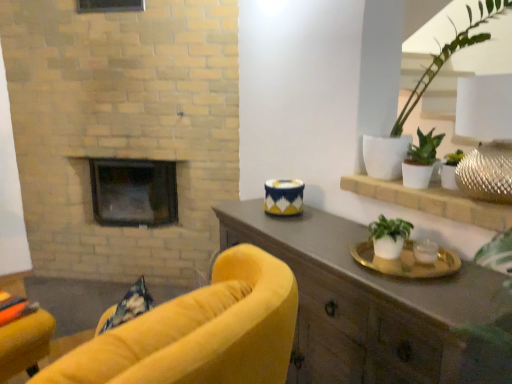
Question: Is white matte pot at upper right, the 1th houseplant from the top, oriented away from white matte plant at right, arranged as the fourth houseplant when viewed from the top?

Choices:
 (A) yes
 (B) no

Answer: (B)

Question: From a real-world perspective, is white matte pot at upper right, the 1th houseplant from the top, on white matte plant at right, arranged as the fourth houseplant when viewed from the top?

Choices:
 (A) no
 (B) yes

Answer: (B)

Question: Does white matte pot at upper right, which appears as the 4th houseplant when ordered from the bottom, come behind white matte plant at right, the first houseplant positioned from the bottom?

Choices:
 (A) yes
 (B) no

Answer: (B)

Question: From a real-world perspective, is white matte pot at upper right, the 1th houseplant from the top, located beneath white matte plant at right, the first houseplant positioned from the bottom?

Choices:
 (A) yes
 (B) no

Answer: (B)

Question: Can you confirm if white matte pot at upper right, which appears as the 4th houseplant when ordered from the bottom, is wider than white matte plant at right, the first houseplant positioned from the bottom?

Choices:
 (A) no
 (B) yes

Answer: (B)

Question: Is white matte plant at right, the first houseplant positioned from the bottom, to the left or to the right of blue and white ceramic candle holder at center in the image?

Choices:
 (A) right
 (B) left

Answer: (A)

Question: Is white matte plant at right, arranged as the fourth houseplant when viewed from the top, spatially inside blue and white ceramic candle holder at center, or outside of it?

Choices:
 (A) inside
 (B) outside

Answer: (B)

Question: Based on their sizes in the image, would you say white matte plant at right, the first houseplant positioned from the bottom, is bigger or smaller than blue and white ceramic candle holder at center?

Choices:
 (A) small
 (B) big

Answer: (A)

Question: Is white matte plant at right, arranged as the fourth houseplant when viewed from the top, in front of or behind blue and white ceramic candle holder at center in the image?

Choices:
 (A) front
 (B) behind

Answer: (A)

Question: From the image's perspective, is black glass fireplace at center above or below white matte plant pot at right, arranged as the second houseplant when viewed from the top?

Choices:
 (A) above
 (B) below

Answer: (B)

Question: From a real-world perspective, is black glass fireplace at center positioned above or below white matte plant pot at right, the 3th houseplant in the bottom-to-top sequence?

Choices:
 (A) above
 (B) below

Answer: (B)

Question: Is point (140, 173) closer or farther from the camera than point (413, 144)?

Choices:
 (A) closer
 (B) farther

Answer: (B)

Question: Choose the correct answer: Is black glass fireplace at center inside white matte plant pot at right, the 3th houseplant in the bottom-to-top sequence, or outside it?

Choices:
 (A) outside
 (B) inside

Answer: (A)

Question: Considering the positions of point (159, 185) and point (410, 188), is point (159, 185) closer or farther from the camera than point (410, 188)?

Choices:
 (A) closer
 (B) farther

Answer: (B)

Question: Considering their positions, is black glass fireplace at center located in front of or behind white ceramic plant at upper right?

Choices:
 (A) front
 (B) behind

Answer: (B)